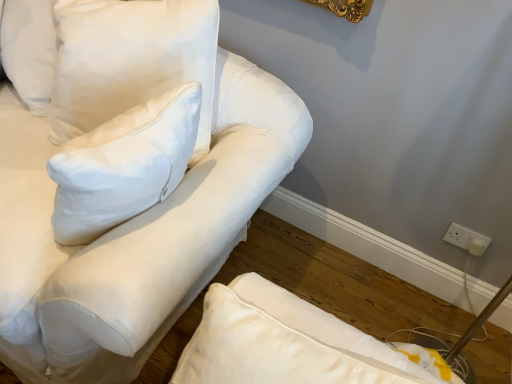
Question: Is white cotton pillow at upper left, which appears as the 2th pillow when viewed from the right, thinner than white cotton sofa at upper left?

Choices:
 (A) yes
 (B) no

Answer: (A)

Question: Does white cotton pillow at upper left, the first pillow when ordered from left to right, lie behind white cotton sofa at upper left?

Choices:
 (A) yes
 (B) no

Answer: (A)

Question: Are white cotton pillow at upper left, which appears as the 2th pillow when viewed from the right, and white cotton sofa at upper left beside each other?

Choices:
 (A) no
 (B) yes

Answer: (A)

Question: Is white cotton pillow at upper left, the first pillow when ordered from left to right, outside white cotton sofa at upper left?

Choices:
 (A) no
 (B) yes

Answer: (A)

Question: From a real-world perspective, is white cotton pillow at upper left, which appears as the 2th pillow when viewed from the right, physically below white cotton sofa at upper left?

Choices:
 (A) yes
 (B) no

Answer: (B)

Question: Could you tell me if white cotton pillow at upper left, which appears as the 2th pillow when viewed from the right, is facing white cotton sofa at upper left?

Choices:
 (A) no
 (B) yes

Answer: (B)

Question: Considering the relative positions of white cotton pillow at upper left, the 2th pillow from the left, and white cotton sofa at upper left in the image provided, is white cotton pillow at upper left, the 2th pillow from the left, in front of white cotton sofa at upper left?

Choices:
 (A) no
 (B) yes

Answer: (A)

Question: Is white cotton pillow at upper left, the first pillow positioned from the right, further to camera compared to white cotton sofa at upper left?

Choices:
 (A) no
 (B) yes

Answer: (B)

Question: Considering the relative sizes of white cotton pillow at upper left, the first pillow positioned from the right, and white cotton sofa at upper left in the image provided, is white cotton pillow at upper left, the first pillow positioned from the right, wider than white cotton sofa at upper left?

Choices:
 (A) no
 (B) yes

Answer: (A)

Question: From a real-world perspective, is white cotton pillow at upper left, the first pillow positioned from the right, below white cotton sofa at upper left?

Choices:
 (A) no
 (B) yes

Answer: (A)

Question: Does white cotton pillow at upper left, the 2th pillow from the left, have a lesser height compared to white cotton sofa at upper left?

Choices:
 (A) yes
 (B) no

Answer: (A)

Question: Is white cotton pillow at upper left, the 2th pillow from the left, beside white cotton sofa at upper left?

Choices:
 (A) yes
 (B) no

Answer: (B)

Question: From the image's perspective, would you say white plastic socket at lower right is shown under white cotton pillow at upper left, the first pillow when ordered from left to right?

Choices:
 (A) yes
 (B) no

Answer: (A)